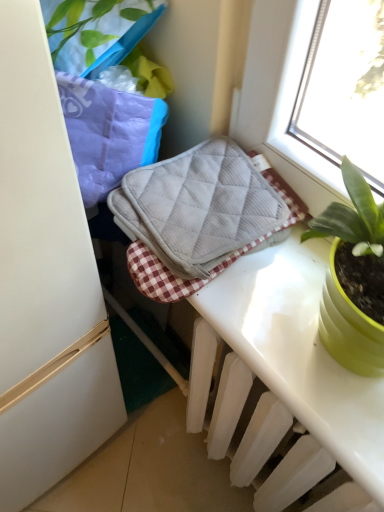
Question: Is white plastic radiator at lower center bigger than gray quilted oven mitt at center?

Choices:
 (A) yes
 (B) no

Answer: (A)

Question: Are white plastic radiator at lower center and gray quilted oven mitt at center making contact?

Choices:
 (A) no
 (B) yes

Answer: (A)

Question: From a real-world perspective, is white plastic radiator at lower center located higher than gray quilted oven mitt at center?

Choices:
 (A) yes
 (B) no

Answer: (B)

Question: Considering the relative sizes of white plastic radiator at lower center and gray quilted oven mitt at center in the image provided, is white plastic radiator at lower center smaller than gray quilted oven mitt at center?

Choices:
 (A) yes
 (B) no

Answer: (B)

Question: Considering the relative sizes of white plastic radiator at lower center and gray quilted oven mitt at center in the image provided, is white plastic radiator at lower center shorter than gray quilted oven mitt at center?

Choices:
 (A) yes
 (B) no

Answer: (B)

Question: Can you confirm if white plastic radiator at lower center is thinner than gray quilted oven mitt at center?

Choices:
 (A) no
 (B) yes

Answer: (B)

Question: From the image's perspective, is gray quilted oven mitt at center located above white plastic radiator at lower center?

Choices:
 (A) yes
 (B) no

Answer: (A)

Question: Would you say gray quilted oven mitt at center is a long distance from white plastic radiator at lower center?

Choices:
 (A) yes
 (B) no

Answer: (B)

Question: From the image's perspective, is gray quilted oven mitt at center beneath white plastic radiator at lower center?

Choices:
 (A) yes
 (B) no

Answer: (B)

Question: From a real-world perspective, is gray quilted oven mitt at center physically above white plastic radiator at lower center?

Choices:
 (A) no
 (B) yes

Answer: (B)

Question: Can you confirm if gray quilted oven mitt at center is taller than white plastic radiator at lower center?

Choices:
 (A) no
 (B) yes

Answer: (A)

Question: Is gray quilted oven mitt at center turned away from white plastic radiator at lower center?

Choices:
 (A) yes
 (B) no

Answer: (B)

Question: In terms of size, does gray quilted oven mitt at center appear bigger or smaller than white plastic radiator at lower center?

Choices:
 (A) small
 (B) big

Answer: (A)